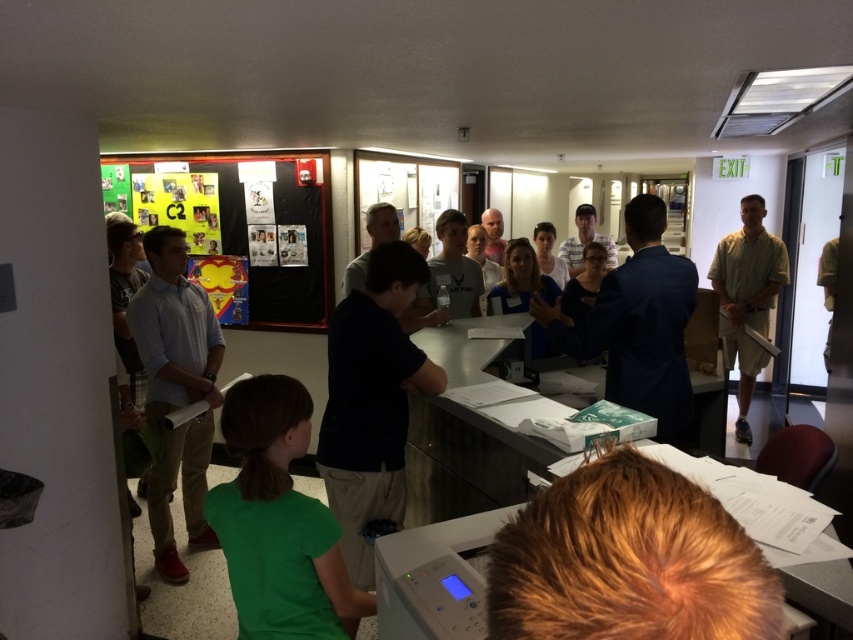
You are organizing a photo shoot and need to ensure that the green matte shirt at lower left and the green textured shirt at right are both visible in the frame. Given their sizes, which shirt might be easier to fit into the composition without overcrowding the scene?

The green matte shirt at lower left occupies less space than the green textured shirt at right, so it would be easier to fit into the composition without overcrowding the scene.

You are standing in the hallway and see both the green matte shirt at lower left and the green textured shirt at right. Which person is closer to you?

The green matte shirt at lower left is closer to you because it is in front of the green textured shirt at right.